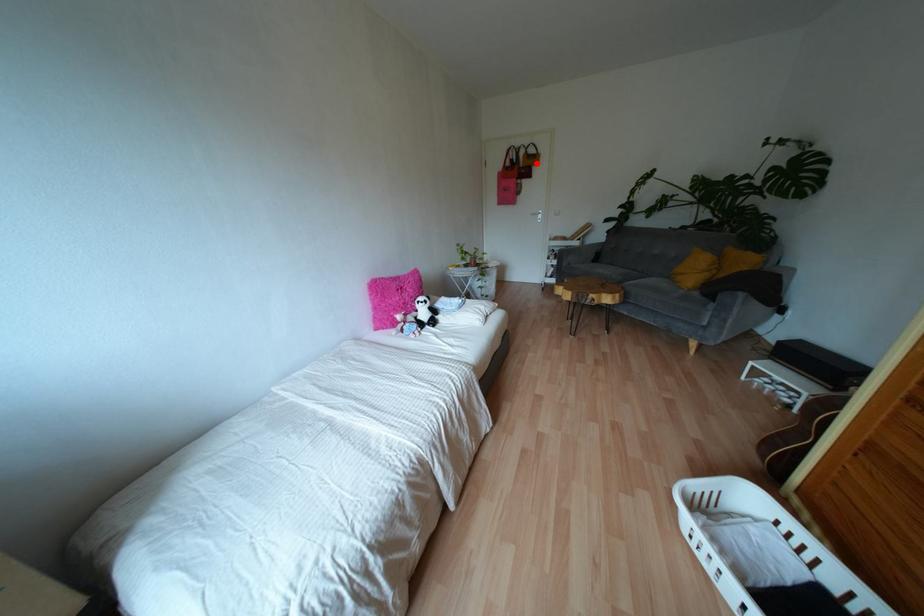
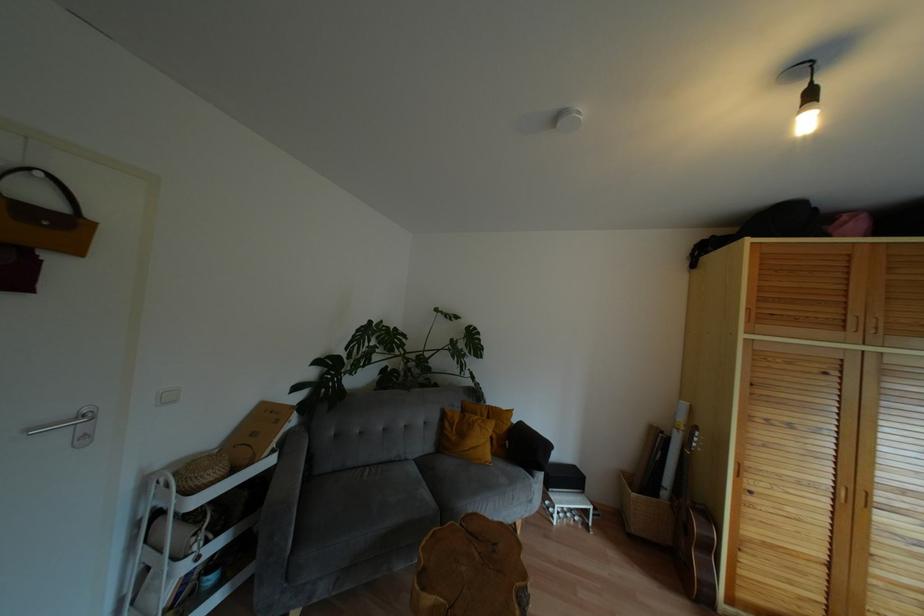
Question: I am providing you with two images of the same scene from different viewpoints. A red point is shown in image1. For the corresponding object point in image2, is it positioned nearer or farther from the camera?

Choices:
 (A) Nearer
 (B) Farther

Answer: (B)